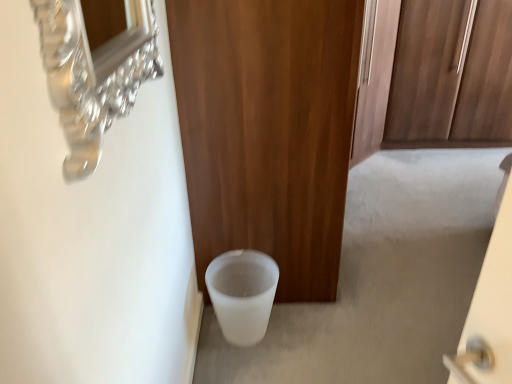
You are a GUI agent. You are given a task and a screenshot of the screen. Output one action in this format:
    pyautogui.click(x=<x>, y=<y>)
    Task: Click on the wooden door at center
    
    Given the screenshot: What is the action you would take?
    268,131

Considering the sizes of objects white frosted glass toilet bowl at lower left and wooden door at center in the image provided, who is bigger, white frosted glass toilet bowl at lower left or wooden door at center?

Bigger between the two is wooden door at center.

Is wooden door at center completely or partially inside white frosted glass toilet bowl at lower left?

No, wooden door at center is not inside white frosted glass toilet bowl at lower left.

Between white frosted glass toilet bowl at lower left and wooden door at center, which one has less height?

With less height is white frosted glass toilet bowl at lower left.

Which is more to the left, white frosted glass toilet bowl at lower left or wooden door at center?

white frosted glass toilet bowl at lower left is more to the left.

Considering the relative positions of wooden door at center and white matte trash can at lower center in the image provided, is wooden door at center behind white matte trash can at lower center?

No, the depth of wooden door at center is less than that of white matte trash can at lower center.

From the image's perspective, is wooden door at center on white matte trash can at lower center?

Yes, from the image's perspective, wooden door at center is above white matte trash can at lower center.

From their relative heights in the image, would you say wooden door at center is taller or shorter than white matte trash can at lower center?

Considering their sizes, wooden door at center has more height than white matte trash can at lower center.

Which object is wider, wooden door at center or white matte trash can at lower center?

Wider between the two is white matte trash can at lower center.

Is wooden door at center facing towards white frosted glass toilet bowl at lower left?

No, wooden door at center does not turn towards white frosted glass toilet bowl at lower left.

Does point (198, 207) appear closer or farther from the camera than point (205, 281)?

Clearly, point (198, 207) is closer to the camera than point (205, 281).

From the picture: From a real-world perspective, is wooden door at center positioned above or below white frosted glass toilet bowl at lower left?

wooden door at center is situated higher than white frosted glass toilet bowl at lower left in the real world.

From the image's perspective, between wooden door at center and white frosted glass toilet bowl at lower left, which one is located above?

wooden door at center is shown above in the image.

Could you tell me if white frosted glass toilet bowl at lower left is facing white matte trash can at lower center?

No, white frosted glass toilet bowl at lower left is not facing towards white matte trash can at lower center.

Would you say white frosted glass toilet bowl at lower left is inside or outside white matte trash can at lower center?

white frosted glass toilet bowl at lower left lies outside white matte trash can at lower center.

Is there a large distance between white frosted glass toilet bowl at lower left and white matte trash can at lower center?

No.

Which object is closer to the camera taking this photo, white frosted glass toilet bowl at lower left or white matte trash can at lower center?

white frosted glass toilet bowl at lower left is closer to the camera.

From their relative heights in the image, would you say white matte trash can at lower center is taller or shorter than white frosted glass toilet bowl at lower left?

In the image, white matte trash can at lower center appears to be shorter than white frosted glass toilet bowl at lower left.

Is white matte trash can at lower center bigger or smaller than white frosted glass toilet bowl at lower left?

Clearly, white matte trash can at lower center is larger in size than white frosted glass toilet bowl at lower left.

Is white matte trash can at lower center wider than white frosted glass toilet bowl at lower left?

Correct, the width of white matte trash can at lower center exceeds that of white frosted glass toilet bowl at lower left.

How distant is white matte trash can at lower center from white frosted glass toilet bowl at lower left?

The distance of white matte trash can at lower center from white frosted glass toilet bowl at lower left is 42.52 centimeters.

Is white matte trash can at lower center oriented towards wooden door at center?

No, white matte trash can at lower center is not facing towards wooden door at center.

Is wooden door at center a part of white matte trash can at lower center?

No, wooden door at center is located outside of white matte trash can at lower center.

Is white matte trash can at lower center taller or shorter than wooden door at center?

white matte trash can at lower center is shorter than wooden door at center.

Considering the relative sizes of white matte trash can at lower center and wooden door at center in the image provided, is white matte trash can at lower center smaller than wooden door at center?

Indeed, white matte trash can at lower center has a smaller size compared to wooden door at center.

This screenshot has width=512, height=384. Identify the location of toilet bowl below the wooden door at center (from the image's perspective). (242, 294).

Where is `concrete that is under the wooden door at center (from a real-world perspective)`? The image size is (512, 384). concrete that is under the wooden door at center (from a real-world perspective) is located at coordinates (381, 279).

Considering their positions, is wooden door at center positioned further to white matte trash can at lower center than white frosted glass toilet bowl at lower left?

Among the two, wooden door at center is located further to white matte trash can at lower center.

Considering their positions, is white matte trash can at lower center positioned further to wooden door at center than white frosted glass toilet bowl at lower left?

Based on the image, white matte trash can at lower center appears to be further to wooden door at center.

Which object lies nearer to the anchor point white matte trash can at lower center, white frosted glass toilet bowl at lower left or wooden door at center?

white frosted glass toilet bowl at lower left is closer to white matte trash can at lower center.

Estimate the real-world distances between objects in this image. Which object is further from white frosted glass toilet bowl at lower left, white matte trash can at lower center or wooden door at center?

Among the two, white matte trash can at lower center is located further to white frosted glass toilet bowl at lower left.

From the image, which object appears to be farther from white frosted glass toilet bowl at lower left, wooden door at center or white matte trash can at lower center?

Among the two, white matte trash can at lower center is located further to white frosted glass toilet bowl at lower left.

When comparing their distances from wooden door at center, does white frosted glass toilet bowl at lower left or white matte trash can at lower center seem closer?

white frosted glass toilet bowl at lower left is positioned closer to the anchor wooden door at center.

At what (x,y) coordinates should I click in order to perform the action: click on concrete between wooden door at center and white frosted glass toilet bowl at lower left in the vertical direction. Please return your answer as a coordinate pair (x, y). Looking at the image, I should click on (381, 279).